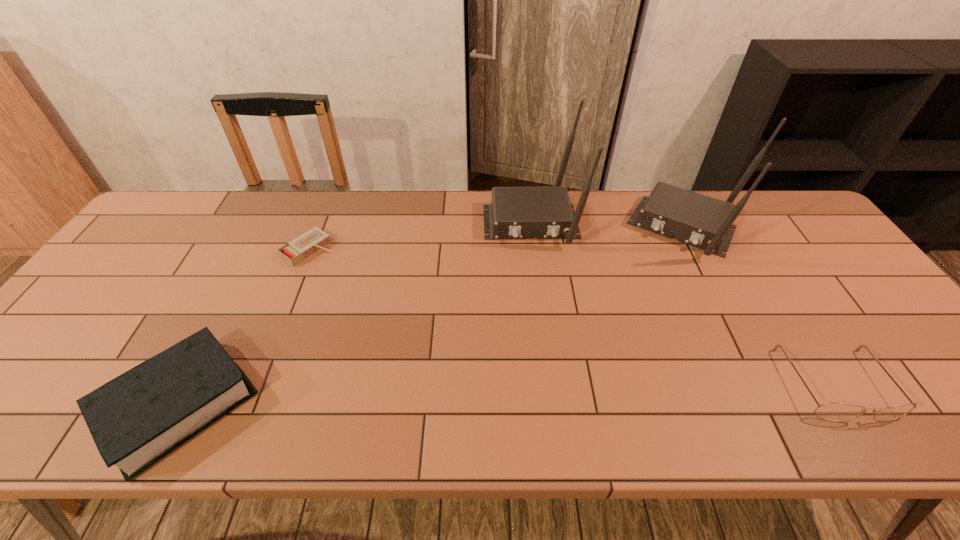
Find the location of a particular element. The image size is (960, 540). free location located 0.160m on the striking surface of the matchbox is located at coordinates (364, 286).

I want to click on vacant space located on the striking surface of the matchbox, so click(369, 289).

Image resolution: width=960 pixels, height=540 pixels. In order to click on vacant space located 0.230m on the back of the right router to connect cables in this screenshot , I will do `click(642, 313)`.

Identify the location of vacant space situated on the back of the right router to connect cables. (647, 303).

Where is `vacant region located 0.400m on the back of the right router to connect cables`? vacant region located 0.400m on the back of the right router to connect cables is located at coordinates (618, 362).

The width and height of the screenshot is (960, 540). Find the location of `matchbox at the far edge`. matchbox at the far edge is located at coordinates (302, 247).

Identify the location of Bible situated at the near edge. (136, 419).

This screenshot has width=960, height=540. I want to click on spectacles situated at the near edge, so click(x=831, y=411).

I want to click on object that is at the right edge, so click(x=831, y=411).

At what (x,y) coordinates should I click in order to perform the action: click on object that is at the near right corner. Please return your answer as a coordinate pair (x, y). Looking at the image, I should click on (831, 411).